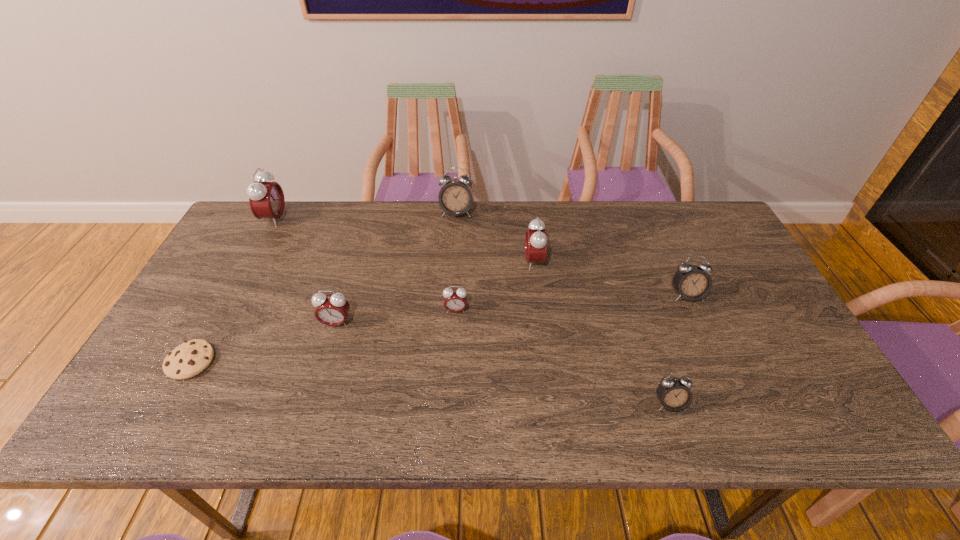
Point out which pink alarm clock is positioned as the nearest to the fourth farthest object. Please provide its 2D coordinates. Your answer should be formatted as a tuple, i.e. [(x, y)], where the tuple contains the x and y coordinates of a point satisfying the conditions above.

[(536, 240)]

Locate an element on the screen. The height and width of the screenshot is (540, 960). the third closest pink alarm clock to the farthest pink alarm clock is located at coordinates (536, 240).

Locate an element on the screen. Image resolution: width=960 pixels, height=540 pixels. white alarm clock that is the third closest to the third smallest pink alarm clock is located at coordinates (674, 394).

Identify which white alarm clock is the second closest to the third nearest alarm clock. Please provide its 2D coordinates. Your answer should be formatted as a tuple, i.e. [(x, y)], where the tuple contains the x and y coordinates of a point satisfying the conditions above.

[(674, 394)]